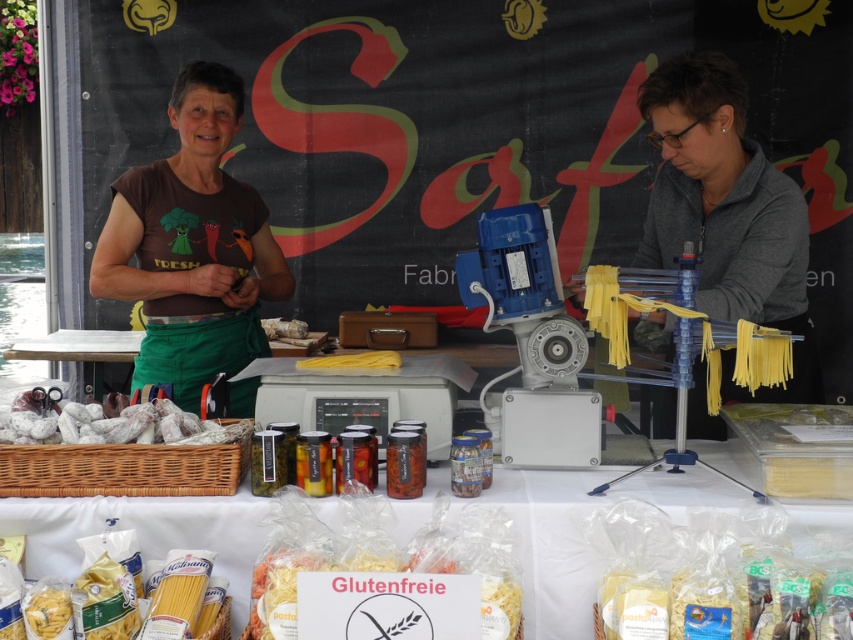
Question: Which object appears closest to the camera in this image?

Choices:
 (A) gluten-free pasta at center
 (B) white paper wrapped at lower left
 (C) brown fabric shirt at center

Answer: (A)

Question: Which point is farther to the camera?

Choices:
 (A) (67, 588)
 (B) (247, 362)

Answer: (B)

Question: Can you confirm if translucent plastic pasta at lower center is thinner than yellow matte pasta at center?

Choices:
 (A) yes
 (B) no

Answer: (B)

Question: Which object appears closest to the camera in this image?

Choices:
 (A) translucent plastic pasta at lower center
 (B) brown fabric shirt at center
 (C) white paper wrapped at lower left

Answer: (A)

Question: Is brown fabric shirt at center positioned before white matte pasta at lower left?

Choices:
 (A) no
 (B) yes

Answer: (A)

Question: Can you confirm if white matte pasta at lower left is positioned to the left of yellow matte pasta at center?

Choices:
 (A) no
 (B) yes

Answer: (B)